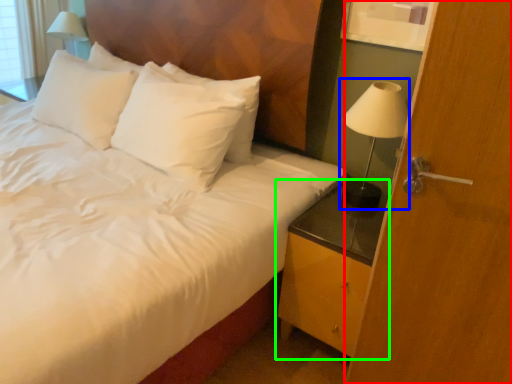
Question: Which object is positioned farthest from screen door (highlighted by a red box)? Select from bedside lamp (highlighted by a blue box) and nightstand (highlighted by a green box).

Choices:
 (A) bedside lamp
 (B) nightstand

Answer: (A)